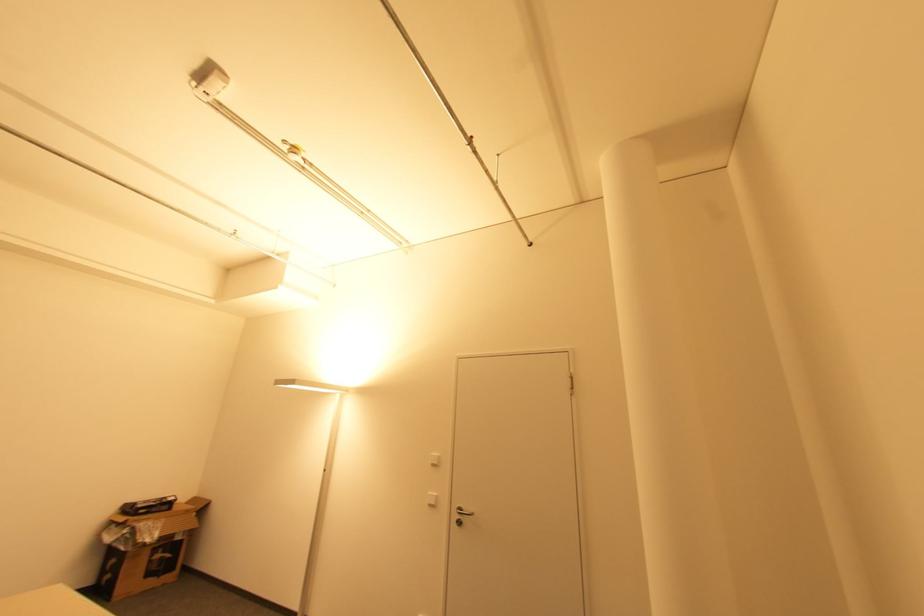
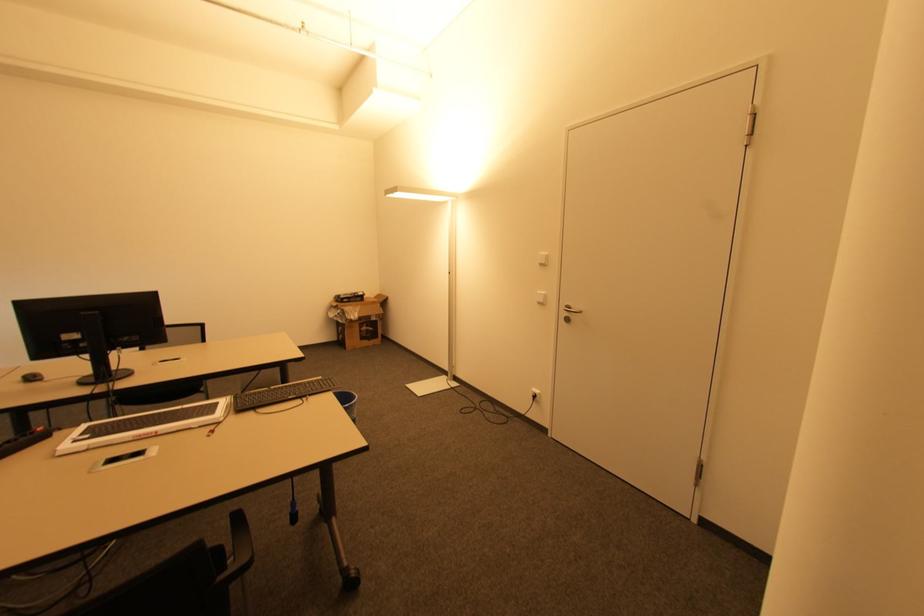
Where in the second image is the point corresponding to the point at 435,466 from the first image?

(542, 265)